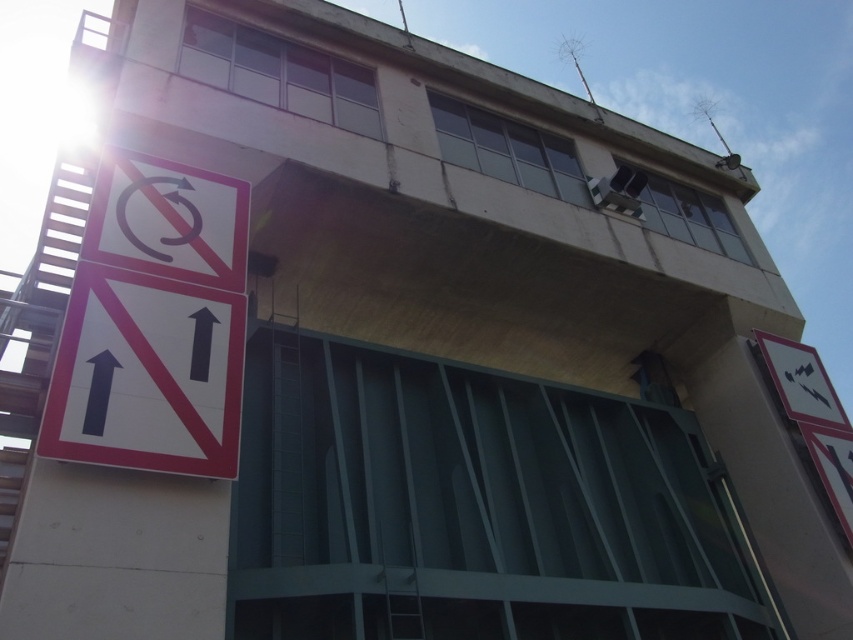
From the picture: Which is more to the right, white matte sign at left or white plastic sign at left?

white matte sign at left

Can you confirm if white matte sign at left is shorter than white plastic sign at left?

Incorrect, white matte sign at left's height does not fall short of white plastic sign at left's.

The width and height of the screenshot is (853, 640). What are the coordinates of `white matte sign at left` in the screenshot? It's located at (146, 376).

The image size is (853, 640). In order to click on white matte sign at left in this screenshot , I will do `click(146, 376)`.